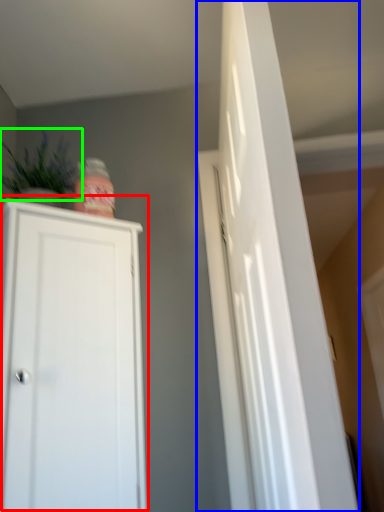
Question: Estimate the real-world distances between objects in this image. Which object is closer to cupboard (highlighted by a red box), door (highlighted by a blue box) or plant (highlighted by a green box)?

Choices:
 (A) door
 (B) plant

Answer: (B)